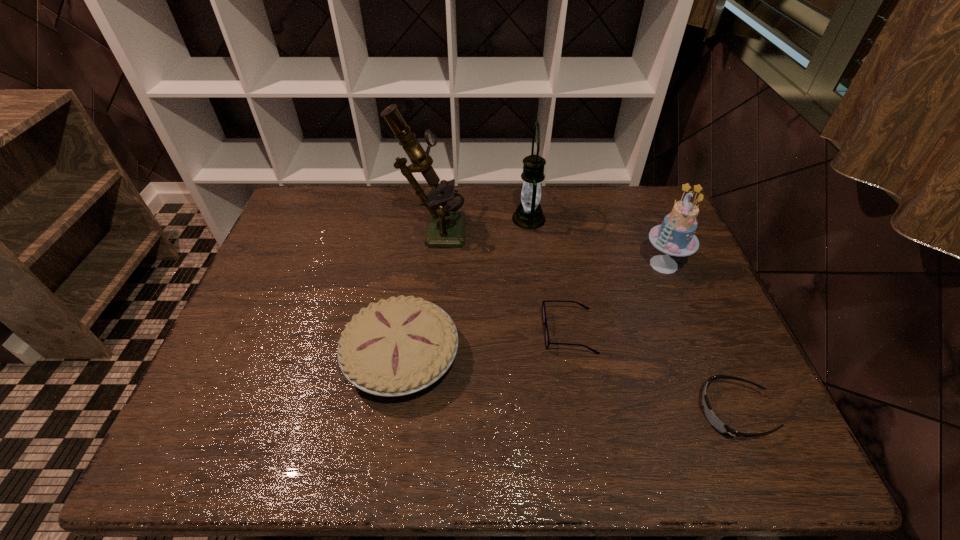
Identify the location of vacant space situated with a ladder on the side of the cake. The image size is (960, 540). (585, 265).

The width and height of the screenshot is (960, 540). Identify the location of free point located 0.150m with a ladder on the side of the cake. click(x=591, y=265).

Locate an element on the screen. vacant space located with a ladder on the side of the cake is located at coordinates (585, 265).

The image size is (960, 540). What are the coordinates of `vacant region located on the front of the pie` in the screenshot? It's located at (388, 455).

Find the location of a particular element. The width and height of the screenshot is (960, 540). free space located on the front-facing side of the spectacles is located at coordinates (451, 332).

Find the location of a particular element. blank space located 0.190m on the front-facing side of the spectacles is located at coordinates (470, 332).

Where is `vacant space located 0.350m on the front-facing side of the spectacles`? Image resolution: width=960 pixels, height=540 pixels. vacant space located 0.350m on the front-facing side of the spectacles is located at coordinates (409, 332).

Locate an element on the screen. This screenshot has height=540, width=960. vacant space located 0.280m on the lenses of the sunglasses is located at coordinates (574, 413).

The height and width of the screenshot is (540, 960). I want to click on vacant region located 0.220m on the lenses of the sunglasses, so click(x=601, y=413).

At what (x,y) coordinates should I click in order to perform the action: click on free space located 0.340m on the lenses of the sunglasses. Please return your answer as a coordinate pair (x, y). Looking at the image, I should click on (548, 413).